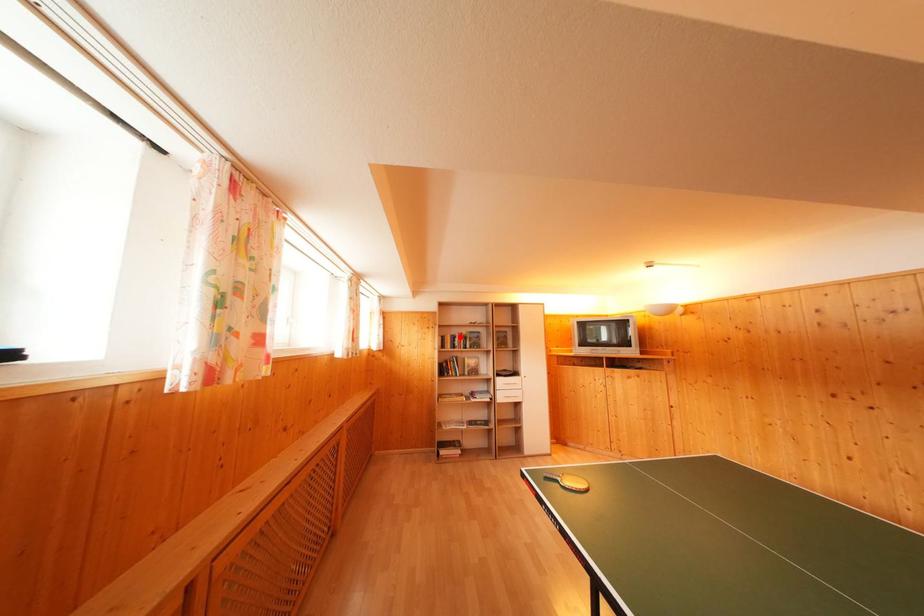
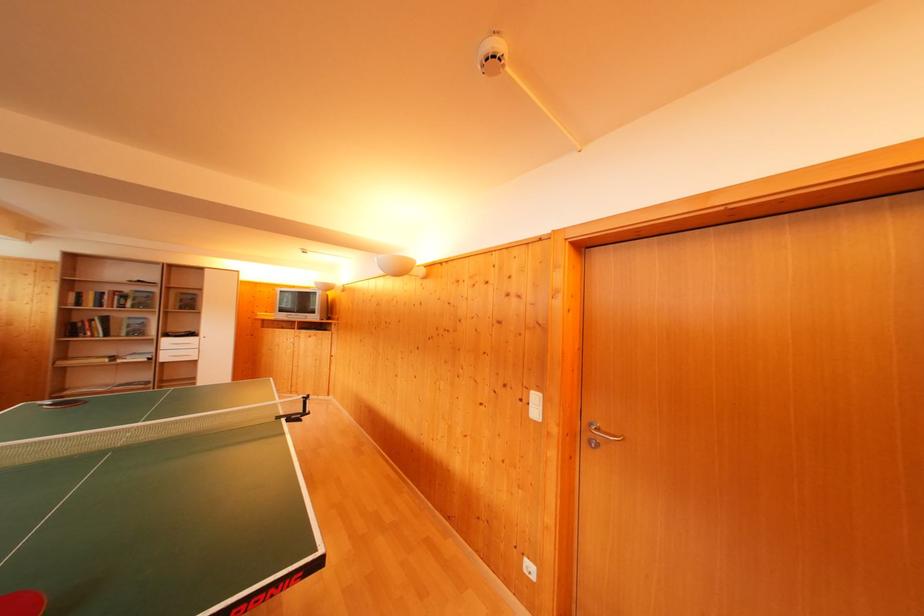
The point at the highlighted location is marked in the first image. Where is the corresponding point in the second image?

(112, 294)